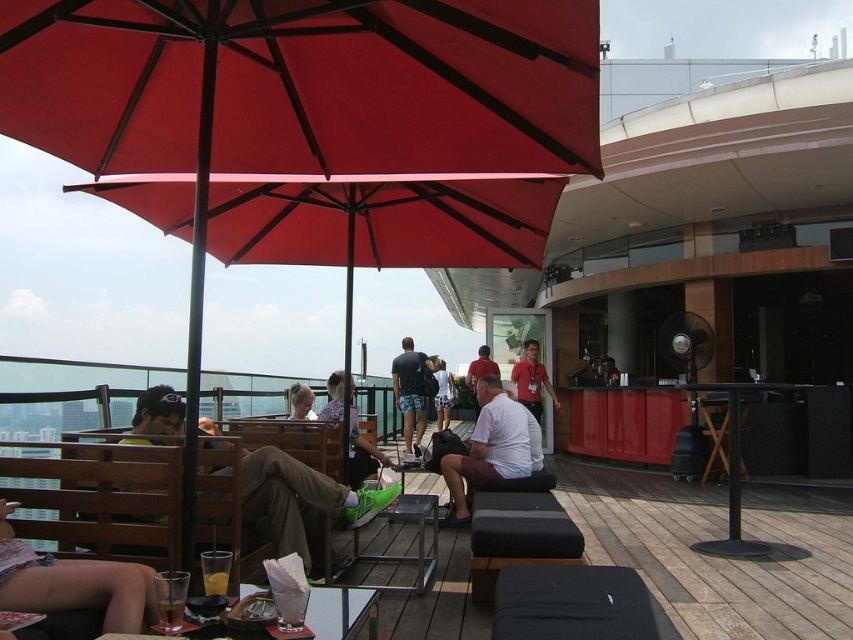
Question: Is white cotton shorts at center below light brown hair at center?

Choices:
 (A) no
 (B) yes

Answer: (B)

Question: Can you confirm if light brown hair at center is positioned above matte red shirt at center?

Choices:
 (A) no
 (B) yes

Answer: (B)

Question: Which point is closer to the camera?

Choices:
 (A) red shirt at center
 (B) light brown hair at center
 (C) white cotton shirt at center

Answer: (C)

Question: Which of these objects is positioned farthest from the dark blue shorts at center?

Choices:
 (A) wooden deck at center
 (B) green suede sneakers at lower center
 (C) denim shorts at center
 (D) white cotton shirt at center

Answer: (B)

Question: Which of the following is the farthest from the observer?

Choices:
 (A) (131, 586)
 (B) (476, 360)

Answer: (B)

Question: Observing the image, what is the correct spatial positioning of red shirt at center in reference to white cotton shorts at center?

Choices:
 (A) below
 (B) above

Answer: (B)